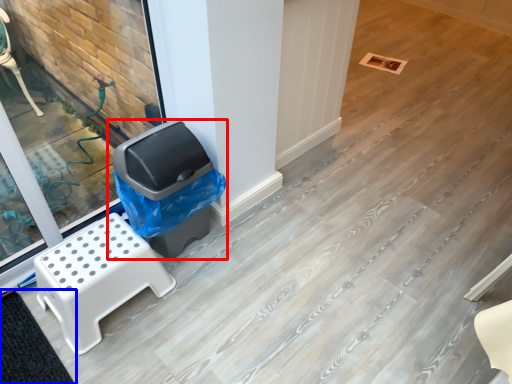
Question: Which point is further to the camera, waste container (highlighted by a red box) or mat (highlighted by a blue box)?

Choices:
 (A) waste container
 (B) mat

Answer: (A)